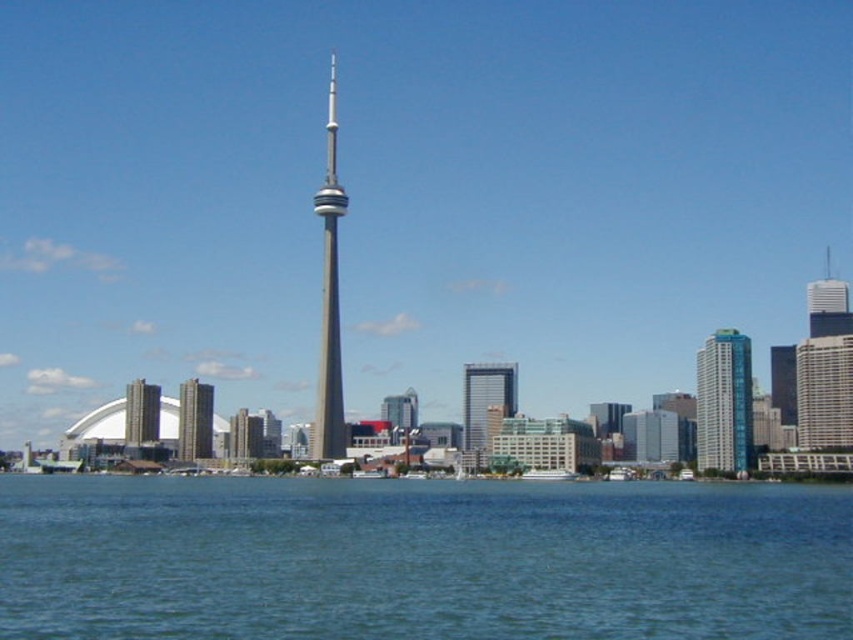
You are standing in the city looking at the skyline with two points marked. The first point is at coordinates point [677,602] and the second is at point [479,394]. Which point is nearer to your eyes?

Point [677,602] is closer to the camera than point [479,394], so the first point is nearer to your eyes.

You are standing at the center of the city square, which is located at coordinates 0,0. You want to take a photo of the glassy reflective skyscraper at center. In which direction should you point your camera to capture it?

The glassy reflective skyscraper at center is located at coordinates (485,406), so you should point your camera northeast to capture it.

In the scene shown: You are a photographer planning to capture the CN Tower and the surrounding buildings. You notice the blue liquid water at lower center and the glassy reflective skyscraper at center. Which object would you need to adjust your camera angle upwards to photograph properly?

The glassy reflective skyscraper at center is taller than the blue liquid water at lower center, so you would need to adjust your camera angle upwards to photograph the glassy reflective skyscraper at center properly.